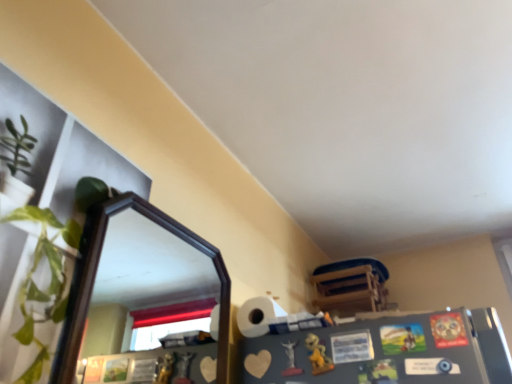
Question: Is black wooden mirror at upper left positioned beyond the bounds of matte plastic statue at lower center, marked as the first toy in a left-to-right arrangement?

Choices:
 (A) yes
 (B) no

Answer: (A)

Question: From a real-world perspective, is black wooden mirror at upper left under matte plastic statue at lower center, positioned as the second toy in right-to-left order?

Choices:
 (A) yes
 (B) no

Answer: (B)

Question: From the image's perspective, is black wooden mirror at upper left on top of matte plastic statue at lower center, positioned as the second toy in right-to-left order?

Choices:
 (A) yes
 (B) no

Answer: (A)

Question: Is black wooden mirror at upper left thinner than matte plastic statue at lower center, positioned as the second toy in right-to-left order?

Choices:
 (A) yes
 (B) no

Answer: (B)

Question: Does black wooden mirror at upper left have a smaller size compared to matte plastic statue at lower center, marked as the first toy in a left-to-right arrangement?

Choices:
 (A) yes
 (B) no

Answer: (B)

Question: Considering the relative sizes of black wooden mirror at upper left and matte plastic statue at lower center, positioned as the second toy in right-to-left order, in the image provided, is black wooden mirror at upper left taller than matte plastic statue at lower center, positioned as the second toy in right-to-left order,?

Choices:
 (A) yes
 (B) no

Answer: (A)

Question: Is wooden chair at upper right at the back of yellow matte toy at lower center, placed as the first toy when sorted from right to left?

Choices:
 (A) no
 (B) yes

Answer: (A)

Question: Can you confirm if yellow matte toy at lower center, placed as the first toy when sorted from right to left, is bigger than wooden chair at upper right?

Choices:
 (A) yes
 (B) no

Answer: (B)

Question: Could you tell me if yellow matte toy at lower center, acting as the second toy starting from the left, is turned towards wooden chair at upper right?

Choices:
 (A) yes
 (B) no

Answer: (B)

Question: Does yellow matte toy at lower center, placed as the first toy when sorted from right to left, have a lesser height compared to wooden chair at upper right?

Choices:
 (A) no
 (B) yes

Answer: (B)

Question: Is yellow matte toy at lower center, placed as the first toy when sorted from right to left, positioned in front of wooden chair at upper right?

Choices:
 (A) yes
 (B) no

Answer: (A)

Question: From the image's perspective, is yellow matte toy at lower center, acting as the second toy starting from the left, beneath wooden chair at upper right?

Choices:
 (A) no
 (B) yes

Answer: (A)

Question: Is wooden chair at upper right a part of black wooden mirror at upper left?

Choices:
 (A) yes
 (B) no

Answer: (B)